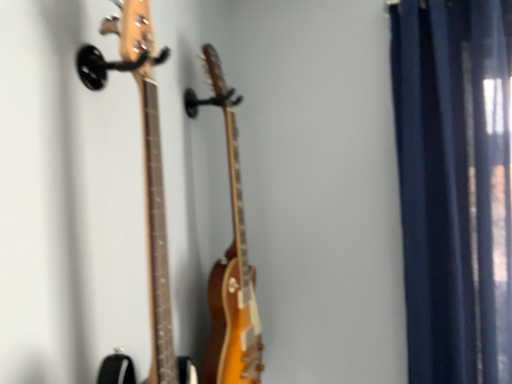
Question: Does dark blue fabric curtain at right have a larger size compared to glossy wood guitar at center, which ranks as the 1th guitar in back-to-front order?

Choices:
 (A) yes
 (B) no

Answer: (A)

Question: From the image's perspective, is dark blue fabric curtain at right on top of glossy wood guitar at center, which appears as the 2th guitar when viewed from the front?

Choices:
 (A) no
 (B) yes

Answer: (B)

Question: Does dark blue fabric curtain at right have a greater height compared to glossy wood guitar at center, which appears as the 2th guitar when viewed from the front?

Choices:
 (A) no
 (B) yes

Answer: (B)

Question: Can you confirm if dark blue fabric curtain at right is shorter than glossy wood guitar at center, which ranks as the 1th guitar in back-to-front order?

Choices:
 (A) no
 (B) yes

Answer: (A)

Question: Would you say dark blue fabric curtain at right is outside glossy wood guitar at center, which appears as the 2th guitar when viewed from the front?

Choices:
 (A) no
 (B) yes

Answer: (B)

Question: In terms of width, does glossy wood guitar at center, which ranks as the 1th guitar in back-to-front order, look wider or thinner when compared to natural wood guitar at left, the 2th guitar from the back?

Choices:
 (A) wide
 (B) thin

Answer: (B)

Question: From the image's perspective, is glossy wood guitar at center, which ranks as the 1th guitar in back-to-front order, positioned above or below natural wood guitar at left, the 2th guitar from the back?

Choices:
 (A) above
 (B) below

Answer: (B)

Question: Considering the positions of glossy wood guitar at center, which appears as the 2th guitar when viewed from the front, and natural wood guitar at left, placed as the 1th guitar when sorted from front to back, in the image, is glossy wood guitar at center, which appears as the 2th guitar when viewed from the front, taller or shorter than natural wood guitar at left, placed as the 1th guitar when sorted from front to back,?

Choices:
 (A) short
 (B) tall

Answer: (B)

Question: Relative to natural wood guitar at left, placed as the 1th guitar when sorted from front to back, is glossy wood guitar at center, which appears as the 2th guitar when viewed from the front, in front or behind?

Choices:
 (A) behind
 (B) front

Answer: (A)

Question: Relative to dark blue fabric curtain at right, is glossy wood guitar at center, which ranks as the 1th guitar in back-to-front order, in front or behind?

Choices:
 (A) behind
 (B) front

Answer: (B)

Question: Does point (230, 167) appear closer or farther from the camera than point (454, 79)?

Choices:
 (A) farther
 (B) closer

Answer: (B)

Question: Is glossy wood guitar at center, which appears as the 2th guitar when viewed from the front, taller or shorter than dark blue fabric curtain at right?

Choices:
 (A) short
 (B) tall

Answer: (A)

Question: In terms of width, does glossy wood guitar at center, which appears as the 2th guitar when viewed from the front, look wider or thinner when compared to dark blue fabric curtain at right?

Choices:
 (A) thin
 (B) wide

Answer: (A)

Question: Is dark blue fabric curtain at right inside or outside of glossy wood guitar at center, which appears as the 2th guitar when viewed from the front?

Choices:
 (A) outside
 (B) inside

Answer: (A)

Question: From a real-world perspective, is dark blue fabric curtain at right above or below glossy wood guitar at center, which appears as the 2th guitar when viewed from the front?

Choices:
 (A) above
 (B) below

Answer: (A)